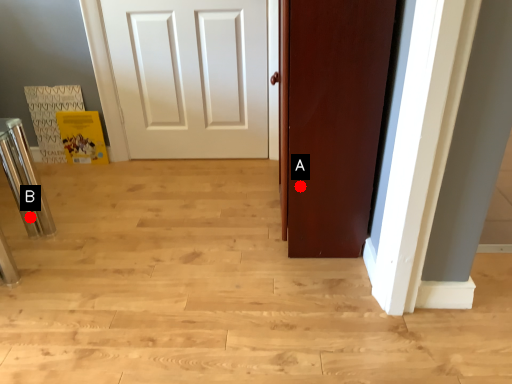
Question: Two points are circled on the image, labeled by A and B beside each circle. Which point appears closest to the camera in this image?

Choices:
 (A) A is closer
 (B) B is closer

Answer: (A)